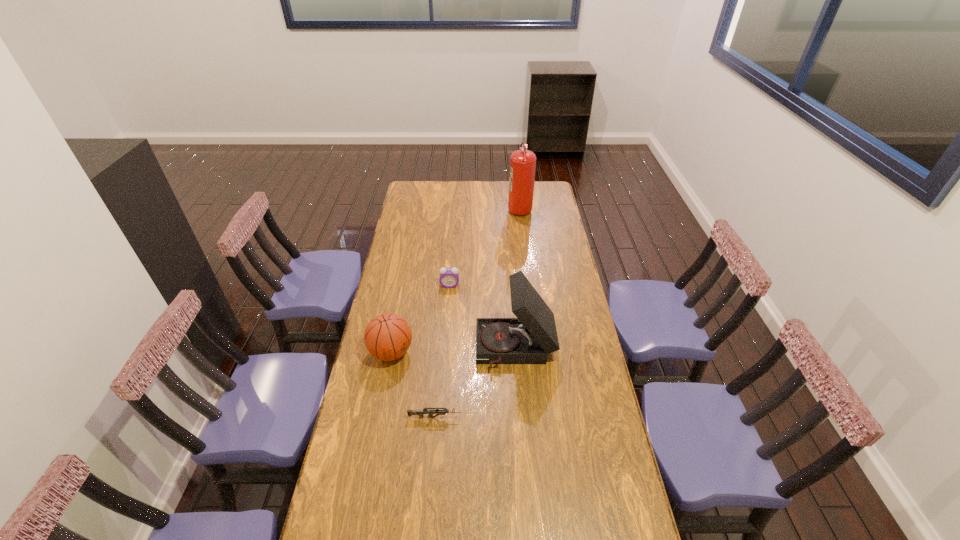
You are a GUI agent. You are given a task and a screenshot of the screen. Output one action in this format:
    pyautogui.click(x=<x>, y=<y>)
    Task: Click on the blank space located on the instruction side of the tallest object
    The image size is (960, 540).
    Given the screenshot: What is the action you would take?
    pyautogui.click(x=444, y=208)

Identify the location of free spot located on the instruction side of the tallest object. (461, 208).

Find the location of `vacant area situated on the front-facing side of the phonograph_record`. vacant area situated on the front-facing side of the phonograph_record is located at coordinates (396, 350).

Where is `free space located on the front-facing side of the phonograph_record`? free space located on the front-facing side of the phonograph_record is located at coordinates (382, 350).

Locate an element on the screen. This screenshot has height=540, width=960. free region located on the front-facing side of the phonograph_record is located at coordinates (445, 350).

In order to click on blank area located 0.100m on the front of the leftmost object in this screenshot , I will do `click(383, 394)`.

Find the location of `vacant space situated on the face of the alarm clock`. vacant space situated on the face of the alarm clock is located at coordinates (444, 349).

Locate an element on the screen. Image resolution: width=960 pixels, height=540 pixels. vacant space located aimed along the barrel of the shortest object is located at coordinates (564, 417).

Locate an element on the screen. object that is at the far edge is located at coordinates (523, 162).

Locate an element on the screen. Image resolution: width=960 pixels, height=540 pixels. object that is at the left edge is located at coordinates (387, 337).